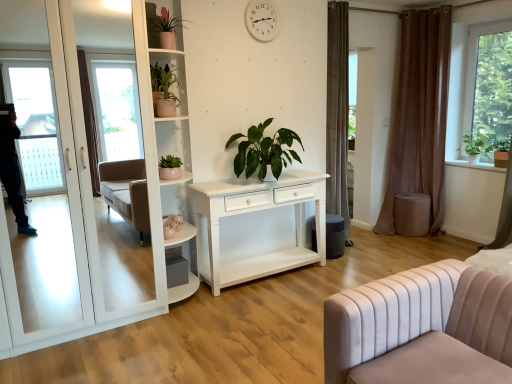
What do you see at coordinates (264, 151) in the screenshot? Image resolution: width=512 pixels, height=384 pixels. I see `green matte plant at center, which is the fourth houseplant from left to right` at bounding box center [264, 151].

I want to click on white glossy screen door at left, so click(50, 207).

How much space does matte pink pot at upper left, placed as the second houseplant when sorted from right to left, occupy horizontally?

matte pink pot at upper left, placed as the second houseplant when sorted from right to left, is 6.15 inches wide.

Where is `white plastic clock at upper center`? This screenshot has width=512, height=384. white plastic clock at upper center is located at coordinates (262, 20).

Find the location of a particular element. green matte plant at upper right is located at coordinates (477, 142).

Who is bigger, white glossy bookshelf at upper left or green matte plant at center, the second houseplant positioned from the left?

white glossy bookshelf at upper left is bigger.

From a real-world perspective, is white glossy bookshelf at upper left under green matte plant at center, the 3th houseplant in the right-to-left sequence?

Incorrect, from a real-world perspective, white glossy bookshelf at upper left is higher than green matte plant at center, the 3th houseplant in the right-to-left sequence.

Is white glossy bookshelf at upper left placed right next to green matte plant at center, the 3th houseplant in the right-to-left sequence?

They are not placed beside each other.

Between white plastic clock at upper center and green matte plant at upper left, positioned as the 4th houseplant in right-to-left order, which one appears on the right side from the viewer's perspective?

white plastic clock at upper center.

Considering the sizes of objects white plastic clock at upper center and green matte plant at upper left, positioned as the 4th houseplant in right-to-left order, in the image provided, who is shorter, white plastic clock at upper center or green matte plant at upper left, positioned as the 4th houseplant in right-to-left order,?

With less height is white plastic clock at upper center.

Considering the sizes of white plastic clock at upper center and green matte plant at upper left, positioned as the 4th houseplant in right-to-left order, in the image, is white plastic clock at upper center bigger or smaller than green matte plant at upper left, positioned as the 4th houseplant in right-to-left order,?

Clearly, white plastic clock at upper center is smaller in size than green matte plant at upper left, positioned as the 4th houseplant in right-to-left order.

Is white glossy screen door at left oriented away from brown velvet curtain at right?

No, white glossy screen door at left's orientation is not away from brown velvet curtain at right.

Is white glossy screen door at left next to brown velvet curtain at right and touching it?

No, white glossy screen door at left is not touching brown velvet curtain at right.

From a real-world perspective, which is physically above, white glossy screen door at left or brown velvet curtain at right?

brown velvet curtain at right, from a real-world perspective.

Considering the sizes of white glossy screen door at left and green matte plant at center, which is the fourth houseplant from left to right, in the image, is white glossy screen door at left taller or shorter than green matte plant at center, which is the fourth houseplant from left to right,?

In the image, white glossy screen door at left appears to be taller than green matte plant at center, which is the fourth houseplant from left to right.

Which point is more forward, (x=79, y=203) or (x=270, y=166)?

Point (x=79, y=203)

Could you tell me if white glossy screen door at left is turned towards green matte plant at center, which is the fourth houseplant from left to right?

No, white glossy screen door at left is not turned towards green matte plant at center, which is the fourth houseplant from left to right.

Who is taller, matte pink pot at upper left, which is the 3th houseplant in left-to-right order, or white glossy screen door at left?

white glossy screen door at left is taller.

Does matte pink pot at upper left, which is the 3th houseplant in left-to-right order, turn towards white glossy screen door at left?

No.

Considering the relative sizes of matte pink pot at upper left, placed as the second houseplant when sorted from right to left, and white glossy screen door at left in the image provided, is matte pink pot at upper left, placed as the second houseplant when sorted from right to left, thinner than white glossy screen door at left?

Correct, the width of matte pink pot at upper left, placed as the second houseplant when sorted from right to left, is less than that of white glossy screen door at left.

Can you confirm if matte pink pot at upper left, which is the 3th houseplant in left-to-right order, is bigger than white glossy screen door at left?

Incorrect, matte pink pot at upper left, which is the 3th houseplant in left-to-right order, is not larger than white glossy screen door at left.

Based on the photo, between velvet beige stool at right and white glossy bookshelf at upper left, which one is positioned in front?

white glossy bookshelf at upper left is closer to the camera.

Is velvet beige stool at right taller than white glossy bookshelf at upper left?

In fact, velvet beige stool at right may be shorter than white glossy bookshelf at upper left.

Can you confirm if velvet beige stool at right is smaller than white glossy bookshelf at upper left?

Indeed, velvet beige stool at right has a smaller size compared to white glossy bookshelf at upper left.

Would you say velvet beige stool at right is a long distance from white glossy bookshelf at upper left?

velvet beige stool at right is far away from white glossy bookshelf at upper left.

Considering the positions of point (172, 107) and point (172, 162), is point (172, 107) closer or farther from the camera than point (172, 162)?

Point (172, 107).

Which is behind, green matte plant at upper left, which is the 1th houseplant from left to right, or green matte plant at center, the 3th houseplant in the right-to-left sequence?

green matte plant at upper left, which is the 1th houseplant from left to right.

What's the angular difference between green matte plant at upper left, which is the 1th houseplant from left to right, and green matte plant at center, the second houseplant positioned from the left,'s facing directions?

There is a 11.9-degree angle between the facing directions of green matte plant at upper left, which is the 1th houseplant from left to right, and green matte plant at center, the second houseplant positioned from the left.

Considering the relative sizes of green matte plant at upper left, positioned as the 4th houseplant in right-to-left order, and green matte plant at center, the second houseplant positioned from the left, in the image provided, is green matte plant at upper left, positioned as the 4th houseplant in right-to-left order, smaller than green matte plant at center, the second houseplant positioned from the left,?

Actually, green matte plant at upper left, positioned as the 4th houseplant in right-to-left order, might be larger than green matte plant at center, the second houseplant positioned from the left.

The width and height of the screenshot is (512, 384). I want to click on bookshelf above the green matte plant at center, the second houseplant positioned from the left (from a real-world perspective), so coord(176,113).

This screenshot has height=384, width=512. What are the coordinates of `houseplant that is the 2nd object directly below the white plastic clock at upper center (from a real-world perspective)` in the screenshot? It's located at (164, 90).

Based on their spatial positions, is white glossy bookshelf at upper left or transparent glass window at upper right closer to velvet beige studio couch at lower right?

Based on the image, white glossy bookshelf at upper left appears to be nearer to velvet beige studio couch at lower right.

From the picture: Considering their positions, is white glossy bookshelf at upper left positioned closer to green matte plant at center, which is the fourth houseplant from left to right, than brown velvet curtain at right?

Based on the image, white glossy bookshelf at upper left appears to be nearer to green matte plant at center, which is the fourth houseplant from left to right.

Looking at this image, which object lies nearer to the anchor point green matte plant at upper right, matte pink pot at upper left, placed as the second houseplant when sorted from right to left, or white glossy screen door at left?

Among the two, matte pink pot at upper left, placed as the second houseplant when sorted from right to left, is located nearer to green matte plant at upper right.

Based on their spatial positions, is white glossy bookshelf at upper left or green matte plant at upper right further from white glossy screen door at left?

Based on the image, green matte plant at upper right appears to be further to white glossy screen door at left.

Based on their spatial positions, is white glossy screen door at left or brown velvet curtain at right further from transparent glass window at upper right?

The object further to transparent glass window at upper right is white glossy screen door at left.

Which object lies nearer to the anchor point green matte plant at center, the second houseplant positioned from the left, matte pink pot at upper left, placed as the second houseplant when sorted from right to left, or transparent glass window at upper right?

The object closer to green matte plant at center, the second houseplant positioned from the left, is matte pink pot at upper left, placed as the second houseplant when sorted from right to left.

When comparing their distances from brown velvet curtain at right, does green matte plant at center, the 1th houseplant viewed from the right, or velvet beige studio couch at lower right seem further?

Based on the image, velvet beige studio couch at lower right appears to be further to brown velvet curtain at right.

Estimate the real-world distances between objects in this image. Which object is closer to white plastic clock at upper center, green matte plant at center, which is the fourth houseplant from left to right, or white glossy bookshelf at upper left?

white glossy bookshelf at upper left is closer to white plastic clock at upper center.

The height and width of the screenshot is (384, 512). Find the location of `bookshelf between velvet beige studio couch at lower right and green matte plant at center, the 3th houseplant in the right-to-left sequence, along the z-axis`. bookshelf between velvet beige studio couch at lower right and green matte plant at center, the 3th houseplant in the right-to-left sequence, along the z-axis is located at coordinates (176, 113).

The height and width of the screenshot is (384, 512). In order to click on clock between green matte plant at upper left, positioned as the 4th houseplant in right-to-left order, and velvet beige stool at right, in the horizontal direction in this screenshot , I will do `click(262, 20)`.

The width and height of the screenshot is (512, 384). In order to click on stool between white glossy screen door at left and green matte plant at upper right from left to right in this screenshot , I will do `click(411, 214)`.

The width and height of the screenshot is (512, 384). What are the coordinates of `studio couch situated between matte pink pot at upper left, placed as the second houseplant when sorted from right to left, and transparent glass window at upper right from left to right` in the screenshot? It's located at 422,328.